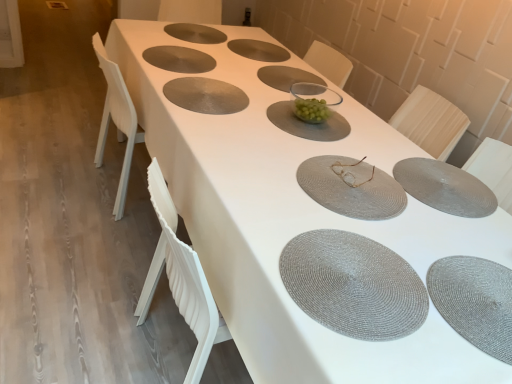
The image size is (512, 384). In order to click on free space that is in between matte gray placemat at upper center, the 7th tableware ordered from the bottom, and gray woven placemat at center, the 2th tableware in the bottom-to-top sequence in this screenshot , I will do `click(276, 107)`.